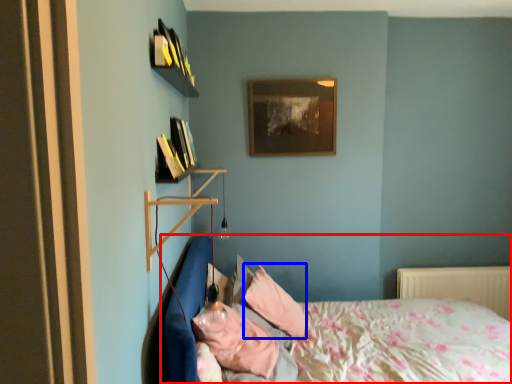
Question: Which of the following is the farthest to the observer, bed (highlighted by a red box) or pillow (highlighted by a blue box)?

Choices:
 (A) bed
 (B) pillow

Answer: (B)